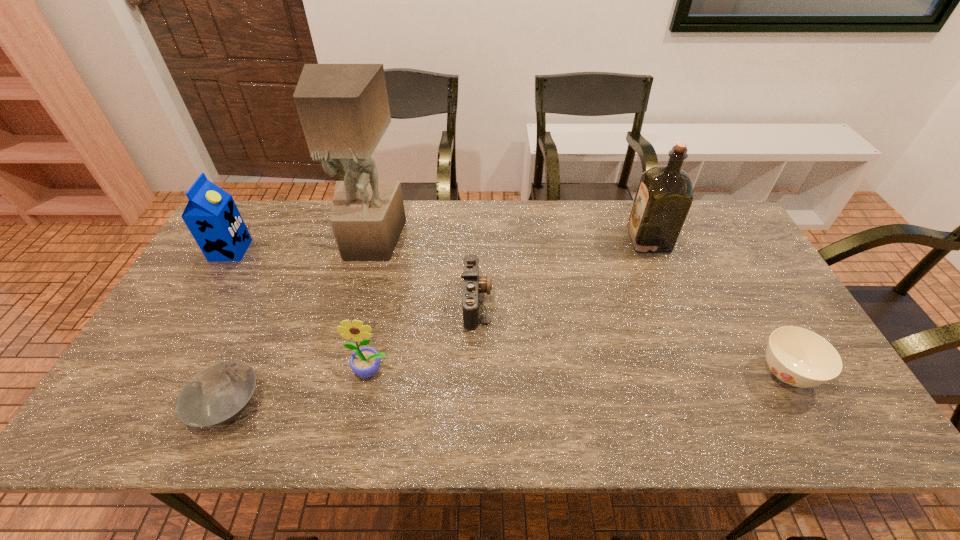
Locate an element on the screen. bowl is located at coordinates (219, 393).

Find the location of a particular element. The width and height of the screenshot is (960, 540). vacant point located 0.130m on the front-facing side of the tallest object is located at coordinates [x=357, y=295].

In order to click on free space located 0.370m on the label of the second object from right to left in this screenshot , I will do `click(516, 240)`.

The width and height of the screenshot is (960, 540). What are the coordinates of `free space located 0.400m on the label of the second object from right to left` in the screenshot? It's located at (506, 240).

Identify the location of free space located on the label of the second object from right to left. (567, 240).

This screenshot has width=960, height=540. Identify the location of free space located 0.400m with the cap open on the carton. coord(374,250).

The width and height of the screenshot is (960, 540). What are the coordinates of `blank area located on the front-facing side of the fourth shortest object` in the screenshot? It's located at (365, 402).

The image size is (960, 540). I want to click on vacant position located on the front-facing side of the fourth farthest object, so click(623, 301).

Where is `free region located on the left of the sugar bowl`? Image resolution: width=960 pixels, height=540 pixels. free region located on the left of the sugar bowl is located at coordinates (624, 374).

Identify the location of free space located on the back of the bowl. This screenshot has height=540, width=960. (284, 275).